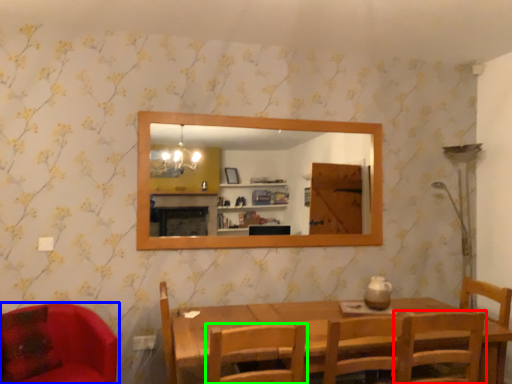
Question: Estimate the real-world distances between objects in this image. Which object is farther from chair (highlighted by a red box), chair (highlighted by a blue box) or chair (highlighted by a green box)?

Choices:
 (A) chair
 (B) chair

Answer: (A)